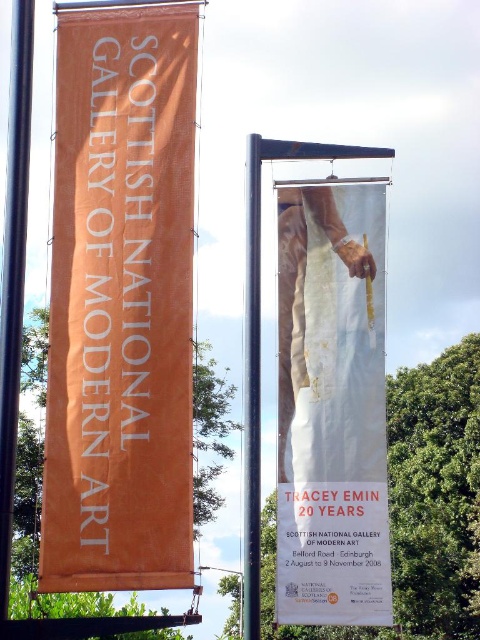
You are standing in front of two banners displayed outdoors. You see the orange fabric banner at left and the white paper at center. Which banner is positioned to the right of the other?

Result: The white paper at center is positioned to the right of the orange fabric banner at left.

You are planning to hang a new banner in the same location as the orange fabric banner at left and the white paper at center. If you want to ensure that the new banner is visible from a distance, which existing banner should you use as a reference for size?

The orange fabric banner at left is larger in size than the white paper at center, so you should use the orange fabric banner at left as a reference for size to ensure visibility from a distance.

You are planning to hang two items on your wall. You have an orange fabric banner at left and a white paper at center. If you want to hang them side by side with equal spacing between them and the wall edges, which item should be placed closer to the center of the wall to maintain balance?

The white paper at center should be placed closer to the center of the wall because its width is smaller than the orange fabric banner at left, so balancing their positions would require the narrower item to be centered more to offset the larger one.